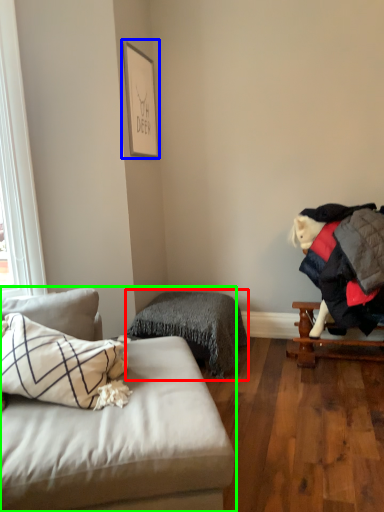
Question: Estimate the real-world distances between objects in this image. Which object is farther from bedding (highlighted by a red box), picture frame (highlighted by a blue box) or studio couch (highlighted by a green box)?

Choices:
 (A) picture frame
 (B) studio couch

Answer: (A)